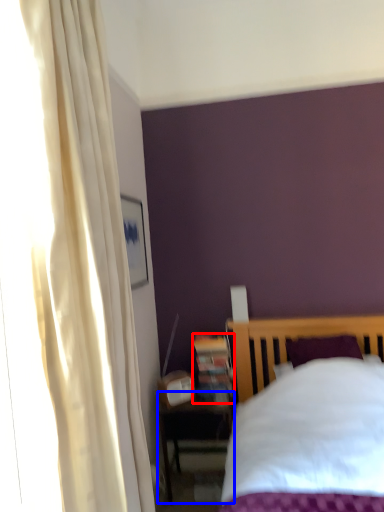
Question: Among these objects, which one is nearest to the camera, bookshelf (highlighted by a red box) or nightstand (highlighted by a blue box)?

Choices:
 (A) bookshelf
 (B) nightstand

Answer: (B)